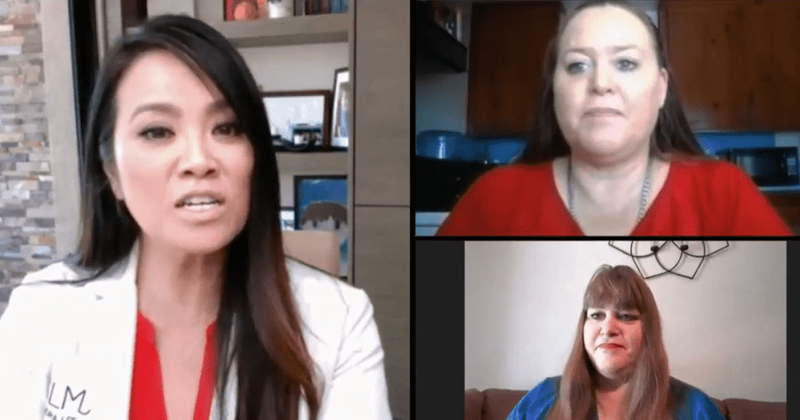
This screenshot has height=420, width=800. What are the coordinates of `beige wall` in the screenshot? It's located at (530, 327).